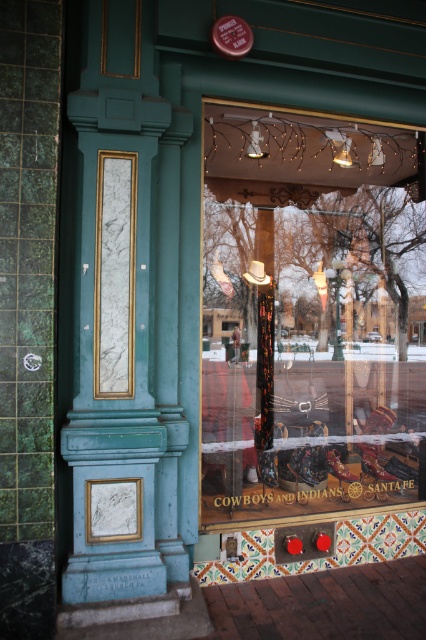
Question: Does matte black cowboy boots at center have a greater width compared to shiny brown leather shoe at center?

Choices:
 (A) yes
 (B) no

Answer: (A)

Question: Which point is closer to the camera taking this photo?

Choices:
 (A) (328, 458)
 (B) (279, 508)

Answer: (B)

Question: Can you confirm if matte black cowboy boots at center is positioned to the right of shiny brown leather shoe at center?

Choices:
 (A) yes
 (B) no

Answer: (B)

Question: Does matte black cowboy boots at center come in front of shiny brown leather shoe at center?

Choices:
 (A) yes
 (B) no

Answer: (A)